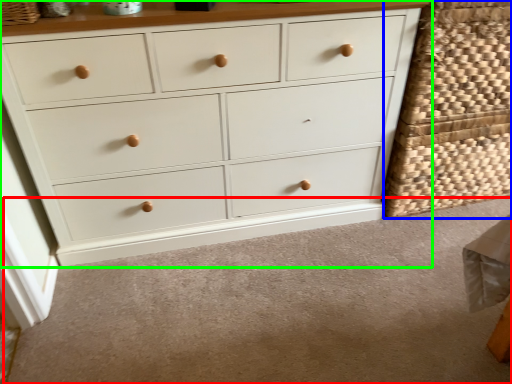
Question: Which object is the farthest from plain (highlighted by a red box)? Choose among these: basket (highlighted by a blue box) or chest of drawers (highlighted by a green box).

Choices:
 (A) basket
 (B) chest of drawers

Answer: (A)